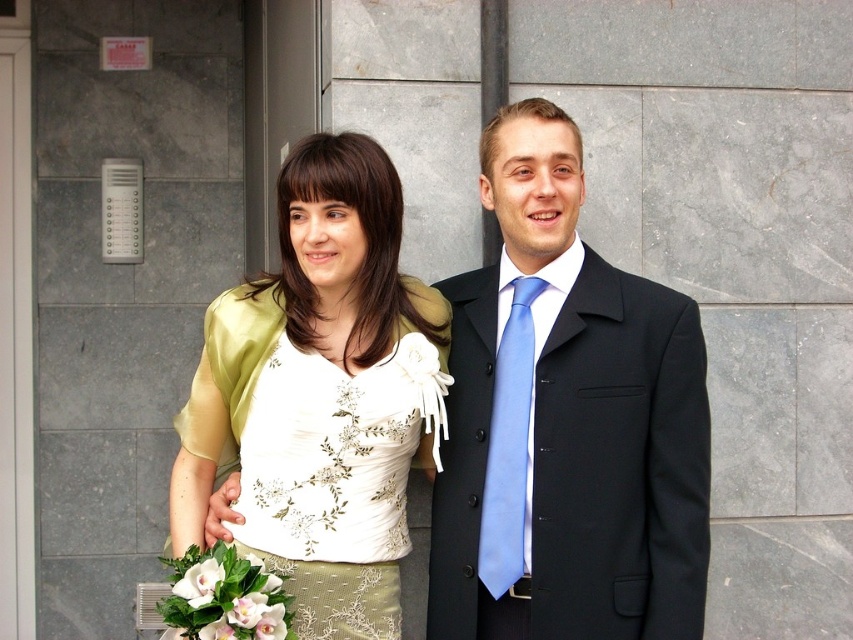
You are a photographer setting up for a group photo. You have two subjects wearing the matte black suit at center and the matte gold blouse at center. Which clothing item takes up more space in the frame?

The matte black suit at center is bigger than the matte gold blouse at center, so it takes up more space in the frame.

You are standing in front of the intercom system on the gray stone wall. You need to reach the black woolen suit at center to hand over a document. Can you reach it without moving from your current position?

The black woolen suit at center is 2.57 meters away from you, so you can reach it without moving from your current position if your arm length is sufficient to cover that distance. However, typically, an average person cannot stretch their arm to 2.57 meters, so you might need to move closer.

You are standing in front of the image and want to determine which of the two points, point (578, 605) or point (498, 536), is nearer to you. Based on the scene, which point is closer?

Point (578, 605) is closer to the viewer than point (498, 536).